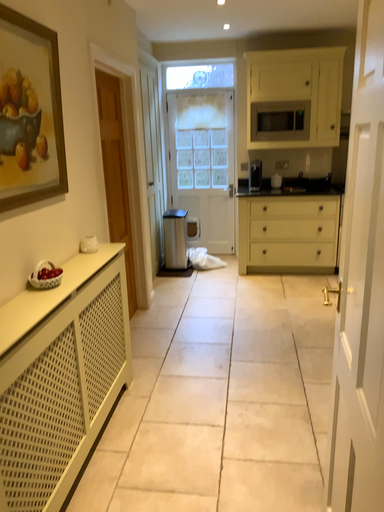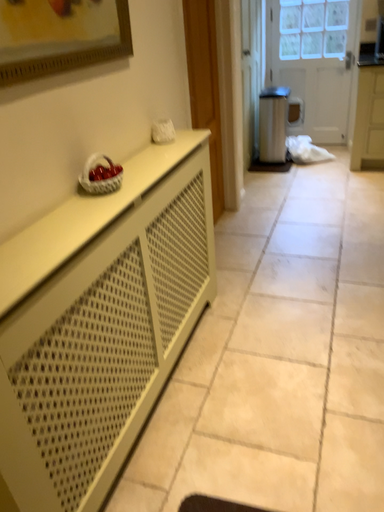
Question: Which way did the camera rotate in the video?

Choices:
 (A) rotated left
 (B) rotated right

Answer: (A)